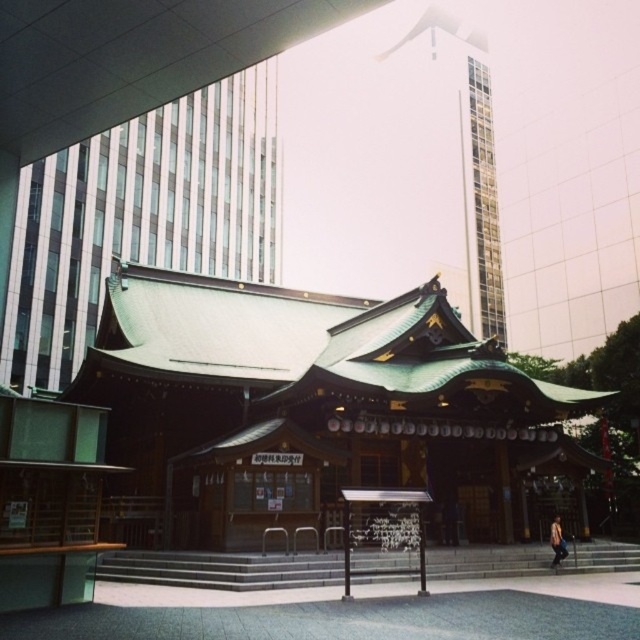
You are standing at the entrance of the shrine and want to take a photo of both the green shingled roof at upper left and the green shingled roof at upper center. Which roof should you position closer to the camera to ensure both are visible in the frame?

You should position the green shingled roof at upper left closer to the camera because it is in front of the green shingled roof at upper center, allowing both to be visible in the frame.